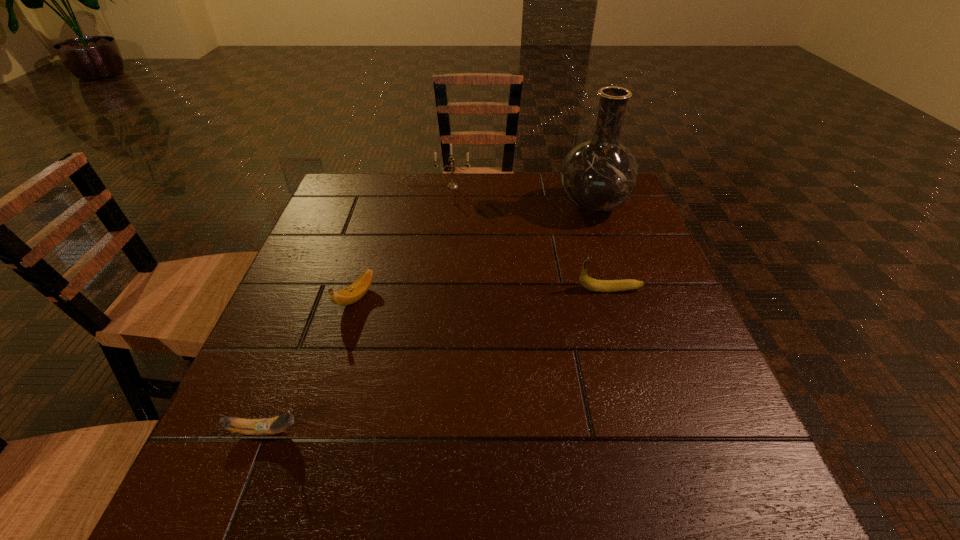
Where is `vacant space at the right edge of the desktop`? vacant space at the right edge of the desktop is located at coordinates [x=686, y=379].

In the image, there is a desktop. In order to click on vacant space at the near left corner in this screenshot , I will do `click(275, 492)`.

At what (x,y) coordinates should I click in order to perform the action: click on free point between the second tallest object and the nearest banana. Please return your answer as a coordinate pair (x, y). This screenshot has width=960, height=540. Looking at the image, I should click on (359, 309).

I want to click on vacant region between the nearest object and the vase, so click(x=428, y=319).

I want to click on free space between the tallest banana and the nearest banana, so (x=437, y=360).

At what (x,y) coordinates should I click in order to perform the action: click on empty location between the third object from left to right and the tallest object. Please return your answer as a coordinate pair (x, y). Image resolution: width=960 pixels, height=540 pixels. Looking at the image, I should click on (523, 197).

Locate an element on the screen. free space between the second tallest object and the tallest banana is located at coordinates (531, 238).

Find the location of `blank region between the nearest object and the vase`. blank region between the nearest object and the vase is located at coordinates (428, 319).

Identify the location of unoccupied position between the fourth shortest object and the tallest banana. (531, 238).

Locate which object is the closest to the tallest object. Please provide its 2D coordinates. Your answer should be formatted as a tuple, i.e. [(x, y)], where the tuple contains the x and y coordinates of a point satisfying the conditions above.

[(587, 282)]